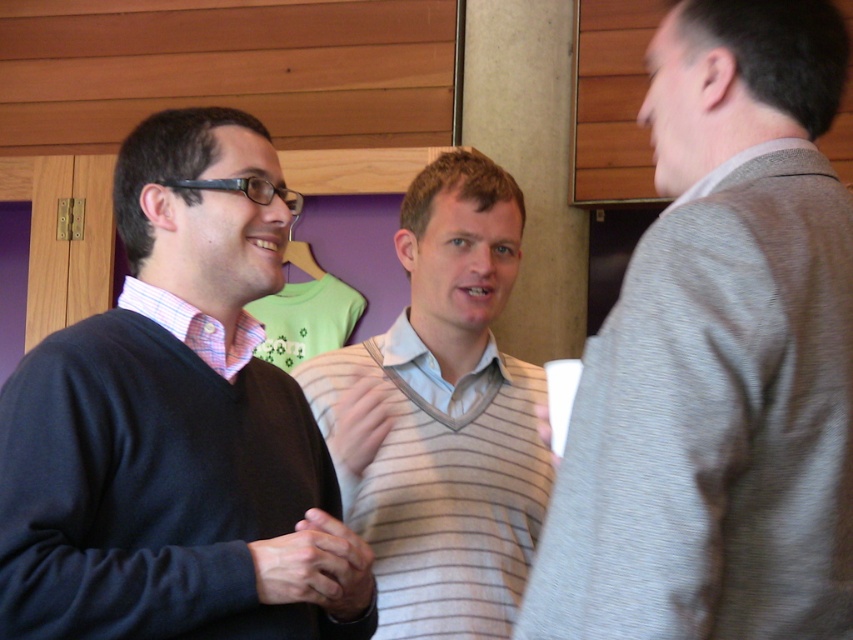
Question: Is striped sweater at right positioned at the back of pink checkered shirt at left?

Choices:
 (A) yes
 (B) no

Answer: (B)

Question: Can you confirm if striped sweater at center is smaller than pink checkered shirt at left?

Choices:
 (A) yes
 (B) no

Answer: (B)

Question: Considering the real-world distances, which object is closest to the matte black sweater at left?

Choices:
 (A) striped sweater at right
 (B) pink checkered shirt at left
 (C) striped sweater at center

Answer: (B)

Question: Among these points, which one is farthest from the camera?

Choices:
 (A) (471, 157)
 (B) (686, 77)
 (C) (122, 420)
 (D) (138, 284)

Answer: (A)

Question: Which is nearer to the striped sweater at right?

Choices:
 (A) striped sweater at center
 (B) matte black sweater at left

Answer: (B)

Question: Is striped sweater at right below matte black sweater at left?

Choices:
 (A) no
 (B) yes

Answer: (A)